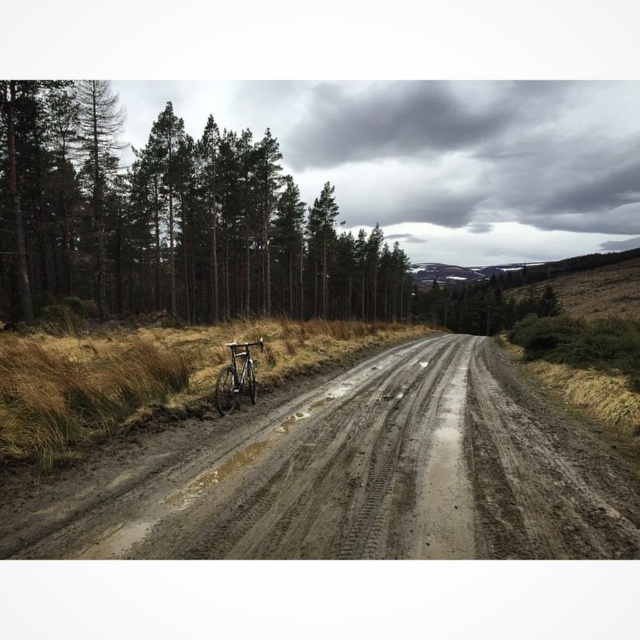
Find the location of a particular element. This screenshot has width=640, height=640. green matte trees at left is located at coordinates (170, 220).

Consider the image. Is green matte trees at left in front of silver metallic bicycle at center?

No, it is behind silver metallic bicycle at center.

The image size is (640, 640). Find the location of `green matte trees at left`. green matte trees at left is located at coordinates (170, 220).

The width and height of the screenshot is (640, 640). Identify the location of green matte trees at left. (170, 220).

The image size is (640, 640). Describe the element at coordinates (378, 476) in the screenshot. I see `dull gray mud at left` at that location.

Between dull gray mud at left and green matte trees at left, which one has more height?

green matte trees at left is taller.

Who is more distant from viewer, (422, 525) or (29, 275)?

Positioned behind is point (29, 275).

You are a GUI agent. You are given a task and a screenshot of the screen. Output one action in this format:
    pyautogui.click(x=<x>, y=<y>)
    Task: Click on the dull gray mud at left
    
    Given the screenshot: What is the action you would take?
    pyautogui.click(x=378, y=476)

Is point (356, 403) farther from viewer compared to point (230, 412)?

Yes, it is.

Can you confirm if dull gray mud at left is bigger than silver metallic bicycle at center?

Correct, dull gray mud at left is larger in size than silver metallic bicycle at center.

Is point (269, 513) farther from camera compared to point (252, 364)?

That is False.

The image size is (640, 640). I want to click on dull gray mud at left, so pos(378,476).